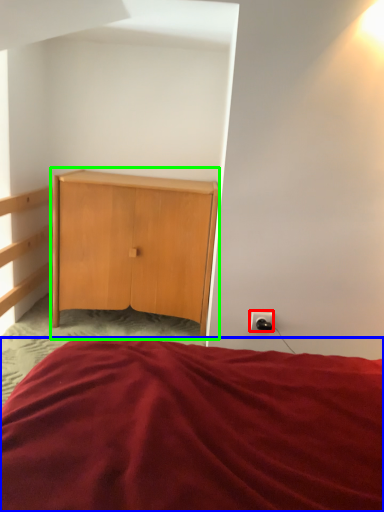
Question: Which object is the farthest from electric outlet (highlighted by a red box)? Choose among these: bed (highlighted by a blue box) or nightstand (highlighted by a green box).

Choices:
 (A) bed
 (B) nightstand

Answer: (B)